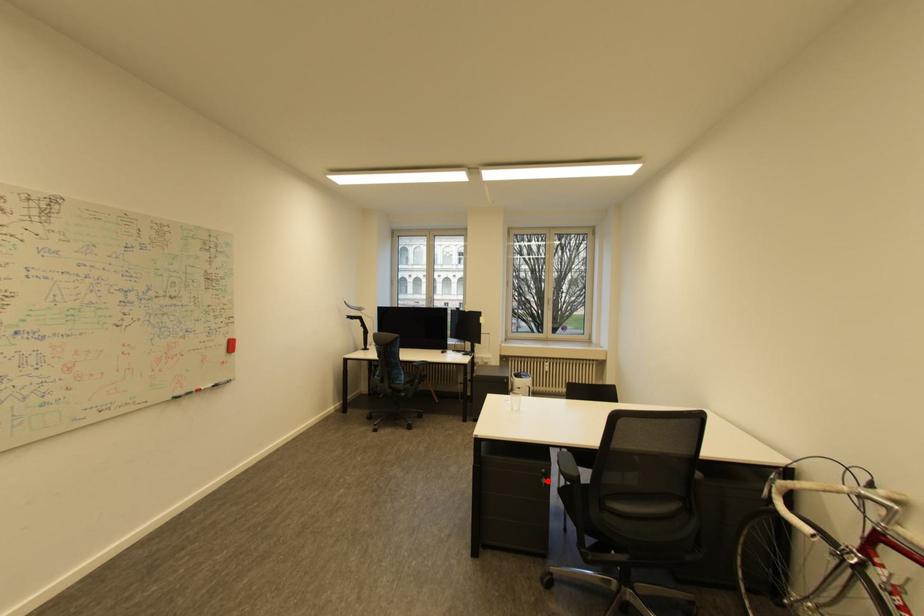
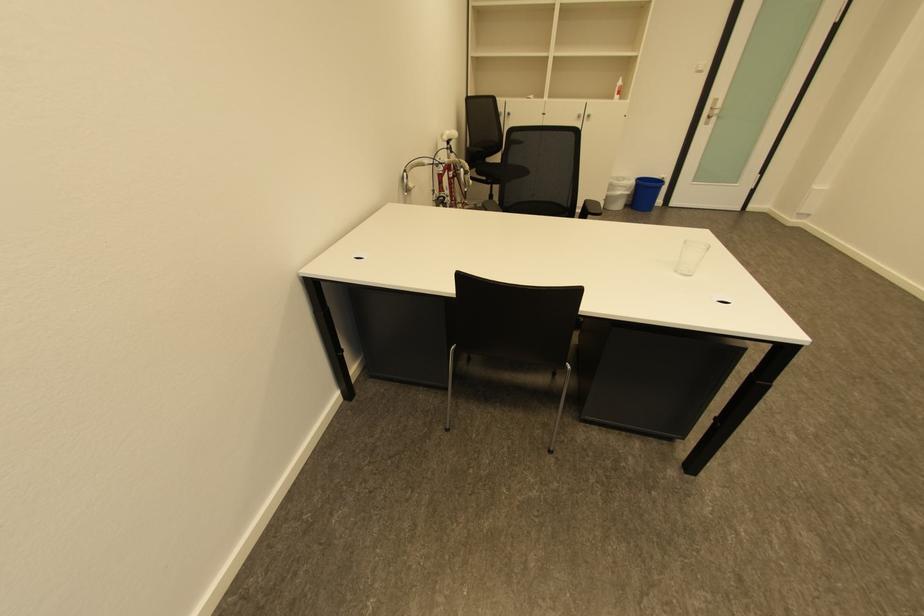
Question: I am providing you with two images of the same scene from different viewpoints. A red point is marked on the first image. Is the red point's position out of view in image 2?

Choices:
 (A) Yes
 (B) No

Answer: (A)